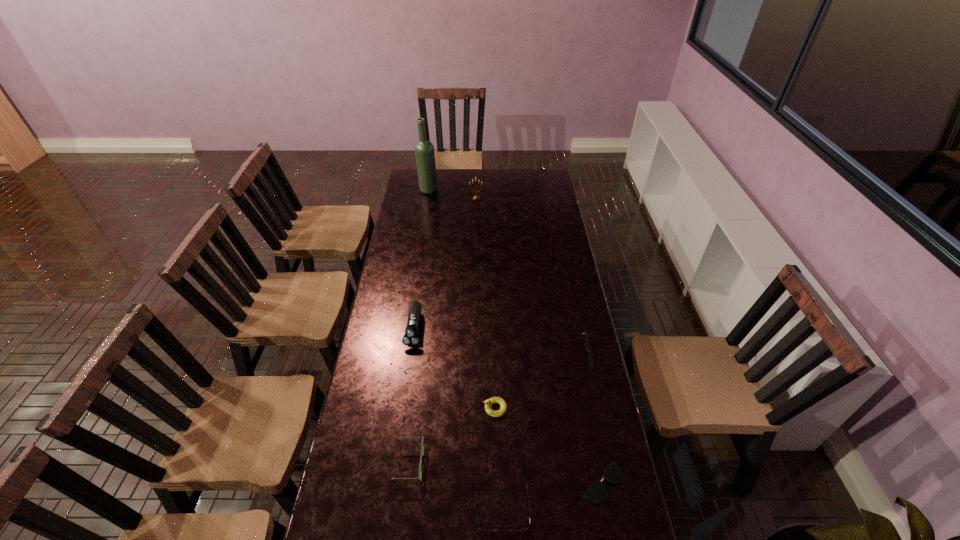
The image size is (960, 540). Find the location of `the tallest object`. the tallest object is located at coordinates (424, 150).

This screenshot has height=540, width=960. Identify the location of wine bottle. (424, 150).

The width and height of the screenshot is (960, 540). I want to click on the second farthest object, so click(474, 197).

The image size is (960, 540). Find the location of `candelabrum`. candelabrum is located at coordinates (474, 197).

In order to click on the third tallest object in this screenshot , I will do `click(411, 338)`.

In order to click on the fourth nearest object in this screenshot , I will do `click(489, 402)`.

You are a GUI agent. You are given a task and a screenshot of the screen. Output one action in this format:
    pyautogui.click(x=<x>, y=<y>)
    Task: Click on the leftmost spectacles
    The width and height of the screenshot is (960, 540).
    Given the screenshot: What is the action you would take?
    pyautogui.click(x=422, y=445)

You are a GUI agent. You are given a task and a screenshot of the screen. Output one action in this format:
    pyautogui.click(x=<x>, y=<y>)
    Task: Click on the farthest spectacles
    
    Given the screenshot: What is the action you would take?
    pyautogui.click(x=587, y=349)

This screenshot has width=960, height=540. I want to click on the third spectacles from right to left, so tap(487, 528).

At what (x,y) coordinates should I click in order to perform the action: click on the second shortest spectacles. Please return your answer as a coordinate pair (x, y). This screenshot has height=540, width=960. Looking at the image, I should click on (487, 528).